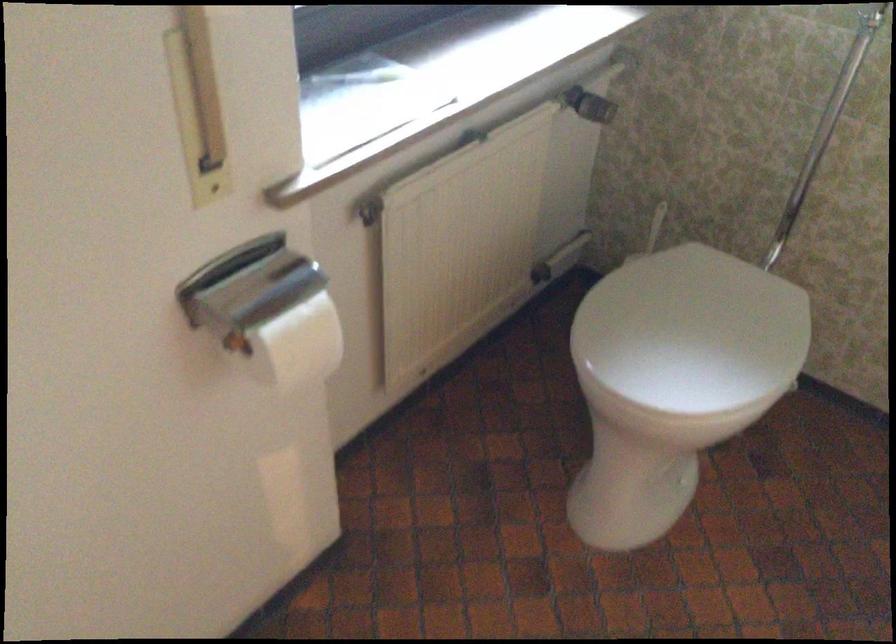
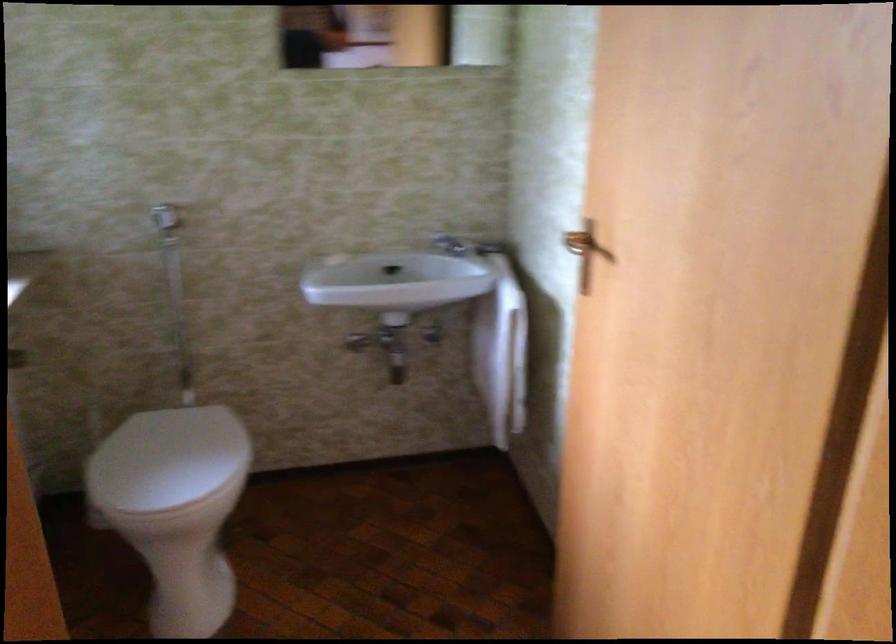
Find the pixel in the second image that matches (675,319) in the first image.

(167, 460)